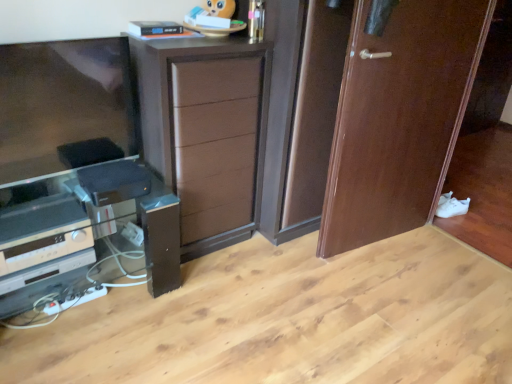
At what (x,y) coordinates should I click in order to perform the action: click on vacant space to the right of black glossy speaker at lower left. Please return your answer as a coordinate pair (x, y). The height and width of the screenshot is (384, 512). Looking at the image, I should click on (219, 314).